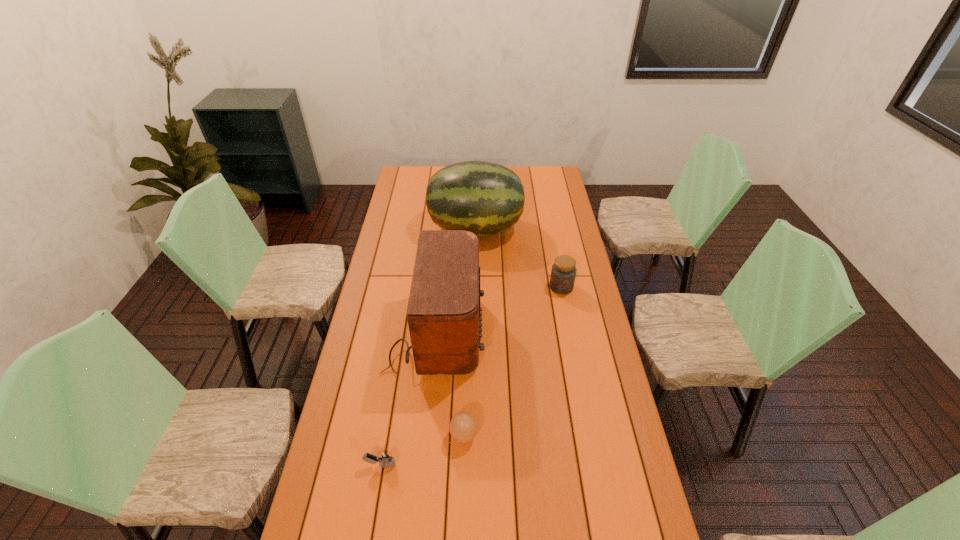
Identify the location of free space between the shortest object and the boiled egg. This screenshot has width=960, height=540. (422, 450).

You are a GUI agent. You are given a task and a screenshot of the screen. Output one action in this format:
    pyautogui.click(x=<x>, y=<y>)
    Task: Click on the vacant space that's between the second shortest object and the jar
    The image size is (960, 540).
    Given the screenshot: What is the action you would take?
    pyautogui.click(x=513, y=361)

Identify the location of free spot between the shortest object and the fourth tallest object. (422, 450).

Identify the location of vacant space that is in between the nearest object and the fourth tallest object. Image resolution: width=960 pixels, height=540 pixels. (422, 450).

The height and width of the screenshot is (540, 960). Find the location of `the fourth closest object to the third tallest object`. the fourth closest object to the third tallest object is located at coordinates (386, 460).

You are a GUI agent. You are given a task and a screenshot of the screen. Output one action in this format:
    pyautogui.click(x=<x>, y=<y>)
    Task: Click on the object that is the second nearest to the igniter
    The height and width of the screenshot is (540, 960).
    Given the screenshot: What is the action you would take?
    pyautogui.click(x=444, y=319)